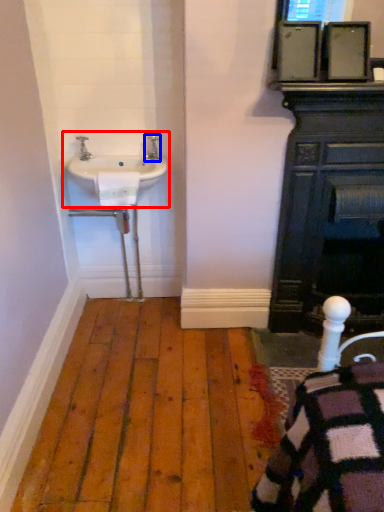
Question: Which object appears closest to the camera in this image, sink (highlighted by a red box) or tap (highlighted by a blue box)?

Choices:
 (A) sink
 (B) tap

Answer: (A)